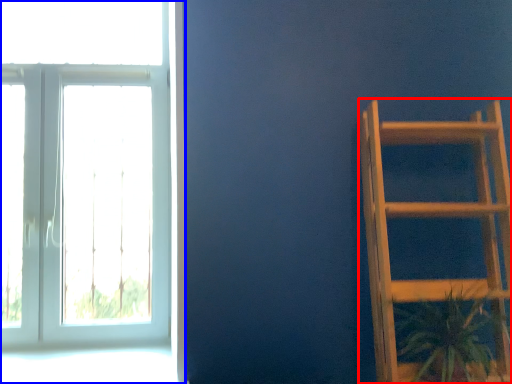
Question: Which of the following is the closest to the observer, furniture (highlighted by a red box) or window (highlighted by a blue box)?

Choices:
 (A) furniture
 (B) window

Answer: (A)